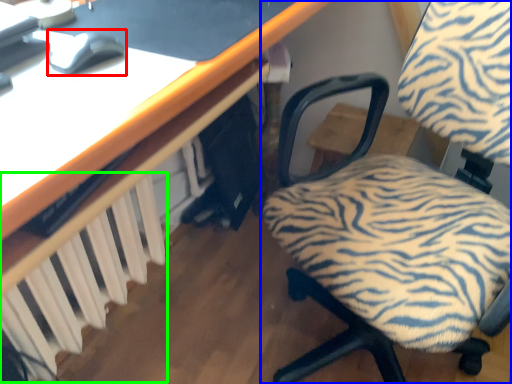
Question: Based on their relative distances, which object is farther from mouse (highlighted by a red box)? Choose from chair (highlighted by a blue box) and radiator (highlighted by a green box).

Choices:
 (A) chair
 (B) radiator

Answer: (A)